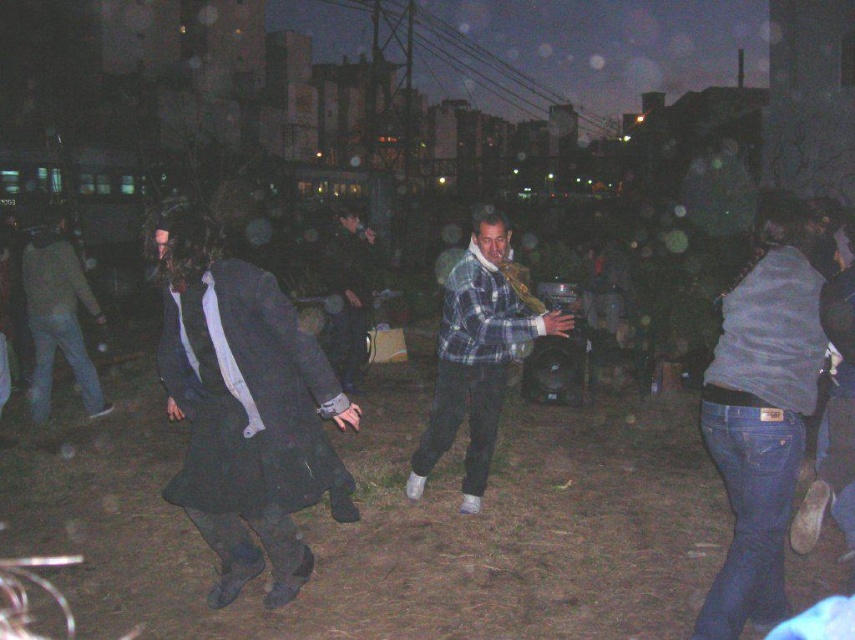
You are at a nighttime gathering and need to pass between the plaid flannel shirt at center and the dark gray flannel shirt at center. The path between them is narrow. If your width is 0.5 meters, can you fit through the space between them?

The plaid flannel shirt at center is 3.34 meters from dark gray flannel shirt at center. Since the distance between them is much larger than your 0.5 meter width, you can easily pass through the space between them.

You are organizing a small event and need to place a 3.5 meter long table between the plaid flannel shirt at center and the dark gray coat at center. Will there be enough space?

The plaid flannel shirt at center and dark gray coat at center are 3.91 meters apart, so yes, a 3.5 meter long table can fit between them since the distance is sufficient.